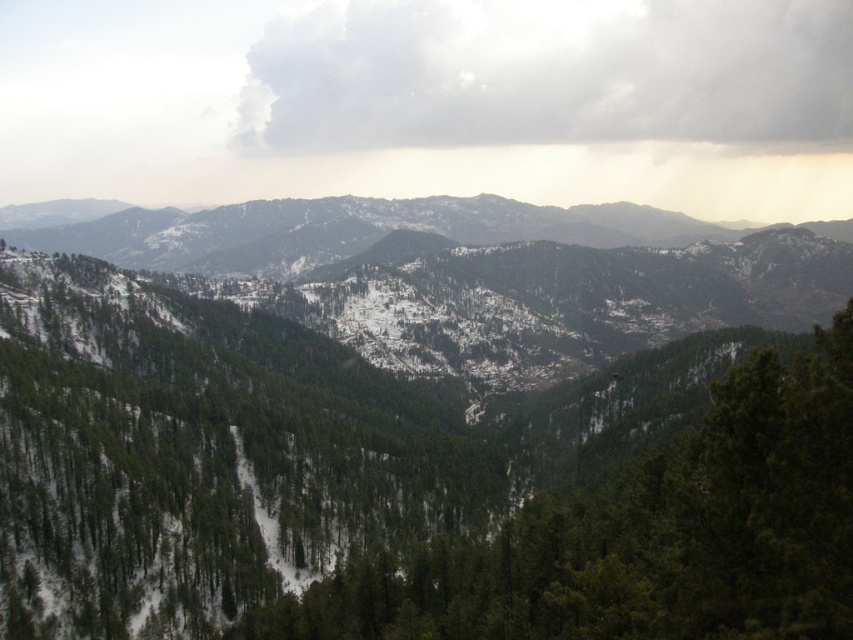
Can you confirm if green matte tree at center is bigger than snowy forested mountain range at center?

Incorrect, green matte tree at center is not larger than snowy forested mountain range at center.

How far apart are green matte tree at center and snowy forested mountain range at center?

The distance of green matte tree at center from snowy forested mountain range at center is 1239.30 feet.

Is point (402, 589) closer to viewer compared to point (277, 241)?

Yes, point (402, 589) is closer to viewer.

The height and width of the screenshot is (640, 853). In order to click on green matte tree at center in this screenshot , I will do `click(645, 536)`.

Who is more distant from viewer, (280, 26) or (357, 200)?

Result: Positioned behind is point (280, 26).

Is white fluffy cloud at upper center above snowy forested mountain range at center?

Indeed, white fluffy cloud at upper center is positioned over snowy forested mountain range at center.

Who is more forward, (x=666, y=74) or (x=119, y=248)?

Positioned in front is point (x=119, y=248).

You are a GUI agent. You are given a task and a screenshot of the screen. Output one action in this format:
    pyautogui.click(x=<x>, y=<y>)
    Task: Click on the white fluffy cloud at upper center
    
    Given the screenshot: What is the action you would take?
    pyautogui.click(x=549, y=74)

Does green matte tree at center have a lesser width compared to white fluffy cloud at upper center?

Correct, green matte tree at center's width is less than white fluffy cloud at upper center's.

Can you confirm if green matte tree at center is positioned above white fluffy cloud at upper center?

Incorrect, green matte tree at center is not positioned above white fluffy cloud at upper center.

This screenshot has width=853, height=640. Find the location of `green matte tree at center`. green matte tree at center is located at coordinates (645, 536).